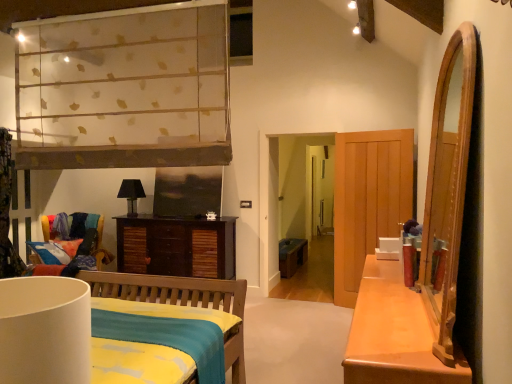
Question: Is teal fabric bench at center in front of or behind dark brown wood cabinet at center in the image?

Choices:
 (A) front
 (B) behind

Answer: (B)

Question: In terms of width, does teal fabric bench at center look wider or thinner when compared to dark brown wood cabinet at center?

Choices:
 (A) wide
 (B) thin

Answer: (B)

Question: Which object is positioned closest to the white matte lampshade at lower left, which is counted as the 2th lamp, starting from the back?

Choices:
 (A) multicolored fabric chair at left
 (B) dark brown wood cabinet at center
 (C) teal fabric bench at center
 (D) matte black lampshade at center, which ranks as the 2th lamp in front-to-back order

Answer: (B)

Question: Which object is positioned closest to the white matte lampshade at lower left, the first lamp in the front-to-back sequence?

Choices:
 (A) dark brown wood cabinet at center
 (B) multicolored fabric chair at left
 (C) matte black lampshade at center, which ranks as the 2th lamp in front-to-back order
 (D) teal fabric bench at center

Answer: (A)